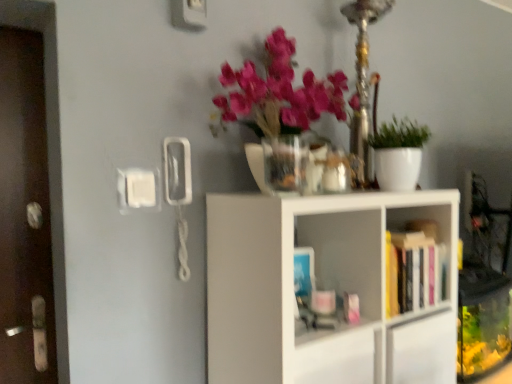
This screenshot has height=384, width=512. Identify the location of translucent glass vase at upper center. pos(285,164).

Image resolution: width=512 pixels, height=384 pixels. What are the coordinates of `hardcover books at center right, positioned as the second shelf in bottom-to-top order` in the screenshot? It's located at (420, 257).

What is the approximate height of brown wooden door at left?

The height of brown wooden door at left is 3.65 feet.

Locate an element on the screen. white matte plant pot at right is located at coordinates (398, 153).

The width and height of the screenshot is (512, 384). In order to click on translucent glass vase at upper center in this screenshot , I will do `click(285, 164)`.

Would you say brown wooden door at left contains translucent glass vase at upper center?

That's incorrect, translucent glass vase at upper center is not inside brown wooden door at left.

Considering the relative sizes of brown wooden door at left and translucent glass vase at upper center in the image provided, is brown wooden door at left taller than translucent glass vase at upper center?

Correct, brown wooden door at left is much taller as translucent glass vase at upper center.

Considering the positions of objects brown wooden door at left and translucent glass vase at upper center in the image provided, who is more to the left, brown wooden door at left or translucent glass vase at upper center?

Positioned to the left is brown wooden door at left.

Considering the relative sizes of brown wooden door at left and translucent glass vase at upper center in the image provided, is brown wooden door at left bigger than translucent glass vase at upper center?

Yes, brown wooden door at left is bigger than translucent glass vase at upper center.

The width and height of the screenshot is (512, 384). There is a white matte shelf at center, placed as the second shelf when sorted from top to bottom. Identify the location of door above it (from a real-world perspective). (24, 208).

Between brown wooden door at left and white matte shelf at center, which is the first shelf from bottom to top, which one appears on the right side from the viewer's perspective?

white matte shelf at center, which is the first shelf from bottom to top, is more to the right.

How many degrees apart are the facing directions of brown wooden door at left and white matte shelf at center, which is the first shelf from bottom to top?

2.55 degrees separate the facing orientations of brown wooden door at left and white matte shelf at center, which is the first shelf from bottom to top.

Is brown wooden door at left situated inside white matte shelf at center, which is the first shelf from bottom to top, or outside?

brown wooden door at left is not enclosed by white matte shelf at center, which is the first shelf from bottom to top.

Can you tell me how much white matte shelf at center, which is the first shelf from bottom to top, and brown wooden door at left differ in facing direction?

2.55 degrees.

From a real-world perspective, which object rests below the other?

From a 3D spatial view, white matte shelf at center, which is the first shelf from bottom to top, is below.

From the image's perspective, is white matte shelf at center, placed as the second shelf when sorted from top to bottom, on brown wooden door at left?

No, from the image's perspective, white matte shelf at center, placed as the second shelf when sorted from top to bottom, is not over brown wooden door at left.

Considering the sizes of objects white matte shelf at center, placed as the second shelf when sorted from top to bottom, and brown wooden door at left in the image provided, who is thinner, white matte shelf at center, placed as the second shelf when sorted from top to bottom, or brown wooden door at left?

Thinner between the two is brown wooden door at left.

Looking at this image, considering the relative positions of white matte shelf at center, placed as the second shelf when sorted from top to bottom, and translucent glass vase at upper center in the image provided, is white matte shelf at center, placed as the second shelf when sorted from top to bottom, behind translucent glass vase at upper center?

No, white matte shelf at center, placed as the second shelf when sorted from top to bottom, is closer to the viewer.

Starting from the translucent glass vase at upper center, which shelf is the 1st one to the right? Please provide its 2D coordinates.

[(322, 288)]

Considering the relative positions of white matte shelf at center, which is the first shelf from bottom to top, and translucent glass vase at upper center in the image provided, is white matte shelf at center, which is the first shelf from bottom to top, to the left of translucent glass vase at upper center from the viewer's perspective?

No.

Considering the sizes of objects white matte shelf at center, placed as the second shelf when sorted from top to bottom, and translucent glass vase at upper center in the image provided, who is taller, white matte shelf at center, placed as the second shelf when sorted from top to bottom, or translucent glass vase at upper center?

white matte shelf at center, placed as the second shelf when sorted from top to bottom, is taller.

Does hardcover books at center right, which is the first shelf in top-to-bottom order, touch brown wooden door at left?

No, hardcover books at center right, which is the first shelf in top-to-bottom order, is not beside brown wooden door at left.

From the image's perspective, would you say hardcover books at center right, positioned as the second shelf in bottom-to-top order, is shown under brown wooden door at left?

Indeed, from the image's perspective, hardcover books at center right, positioned as the second shelf in bottom-to-top order, is shown beneath brown wooden door at left.

From a real-world perspective, is hardcover books at center right, which is the first shelf in top-to-bottom order, located higher than brown wooden door at left?

No, from a real-world perspective, hardcover books at center right, which is the first shelf in top-to-bottom order, is not over brown wooden door at left

Which of these two, hardcover books at center right, which is the first shelf in top-to-bottom order, or brown wooden door at left, stands taller?

With more height is brown wooden door at left.

Is translucent glass vase at upper center next to brown wooden door at left?

There is a gap between translucent glass vase at upper center and brown wooden door at left.

Find the location of a particular element. door below the translucent glass vase at upper center (from the image's perspective) is located at coordinates (24, 208).

Is brown wooden door at left located within translucent glass vase at upper center?

No, brown wooden door at left is not surrounded by translucent glass vase at upper center.

From the image's perspective, which one is positioned lower, translucent glass vase at upper center or brown wooden door at left?

brown wooden door at left.

Consider the image. Is hardcover books at center right, which is the first shelf in top-to-bottom order, inside white matte shelf at center, placed as the second shelf when sorted from top to bottom?

Yes, white matte shelf at center, placed as the second shelf when sorted from top to bottom, is surrounding hardcover books at center right, which is the first shelf in top-to-bottom order.

Does white matte shelf at center, which is the first shelf from bottom to top, have a lesser height compared to hardcover books at center right, which is the first shelf in top-to-bottom order?

No.

Is white matte shelf at center, which is the first shelf from bottom to top, in front of or behind hardcover books at center right, which is the first shelf in top-to-bottom order, in the image?

white matte shelf at center, which is the first shelf from bottom to top, is in front of hardcover books at center right, which is the first shelf in top-to-bottom order.

Which is farther from the camera, (228, 370) or (420, 211)?

The point (420, 211) is farther.

This screenshot has height=384, width=512. In order to click on vase that appears above the brown wooden door at left (from the image's perspective) in this screenshot , I will do `click(285, 164)`.

You are a GUI agent. You are given a task and a screenshot of the screen. Output one action in this format:
    pyautogui.click(x=<x>, y=<y>)
    Task: Click on the shelf that is the 1st object to the right of the brown wooden door at left, starting at the anchor
    The height and width of the screenshot is (384, 512).
    Given the screenshot: What is the action you would take?
    pyautogui.click(x=322, y=288)

Considering their positions, is translucent glass vase at upper center positioned further to hardcover books at center right, positioned as the second shelf in bottom-to-top order, than brown wooden door at left?

Based on the image, brown wooden door at left appears to be further to hardcover books at center right, positioned as the second shelf in bottom-to-top order.

When comparing their distances from white matte plant pot at right, does brown wooden door at left or white matte shelf at center, which is the first shelf from bottom to top, seem closer?

white matte shelf at center, which is the first shelf from bottom to top, is positioned closer to the anchor white matte plant pot at right.

Considering their positions, is hardcover books at center right, which is the first shelf in top-to-bottom order, positioned closer to white matte plant pot at right than brown wooden door at left?

Based on the image, hardcover books at center right, which is the first shelf in top-to-bottom order, appears to be nearer to white matte plant pot at right.

Considering their positions, is translucent glass vase at upper center positioned closer to white matte shelf at center, which is the first shelf from bottom to top, than white matte plant pot at right?

Based on the image, translucent glass vase at upper center appears to be nearer to white matte shelf at center, which is the first shelf from bottom to top.

Which object lies nearer to the anchor point translucent glass vase at upper center, white matte shelf at center, which is the first shelf from bottom to top, or brown wooden door at left?

white matte shelf at center, which is the first shelf from bottom to top, lies closer to translucent glass vase at upper center than the other object.

From the image, which object appears to be farther from translucent glass vase at upper center, hardcover books at center right, positioned as the second shelf in bottom-to-top order, or white matte shelf at center, placed as the second shelf when sorted from top to bottom?

hardcover books at center right, positioned as the second shelf in bottom-to-top order, lies further to translucent glass vase at upper center than the other object.

When comparing their distances from translucent glass vase at upper center, does white matte plant pot at right or hardcover books at center right, which is the first shelf in top-to-bottom order, seem closer?

The object closer to translucent glass vase at upper center is white matte plant pot at right.

Estimate the real-world distances between objects in this image. Which object is further from white matte plant pot at right, translucent glass vase at upper center or brown wooden door at left?

brown wooden door at left lies further to white matte plant pot at right than the other object.

Where is `houseplant situated between brown wooden door at left and hardcover books at center right, positioned as the second shelf in bottom-to-top order, from left to right`? houseplant situated between brown wooden door at left and hardcover books at center right, positioned as the second shelf in bottom-to-top order, from left to right is located at coordinates (398, 153).

You are a GUI agent. You are given a task and a screenshot of the screen. Output one action in this format:
    pyautogui.click(x=<x>, y=<y>)
    Task: Click on the shelf between translucent glass vase at upper center and white matte shelf at center, which is the first shelf from bottom to top, in the vertical direction
    
    Given the screenshot: What is the action you would take?
    pyautogui.click(x=420, y=257)

Identify the location of shelf that lies between white matte plant pot at right and white matte shelf at center, placed as the second shelf when sorted from top to bottom, from top to bottom. (420, 257).

Where is `vase situated between brown wooden door at left and white matte plant pot at right from left to right`? vase situated between brown wooden door at left and white matte plant pot at right from left to right is located at coordinates (285, 164).